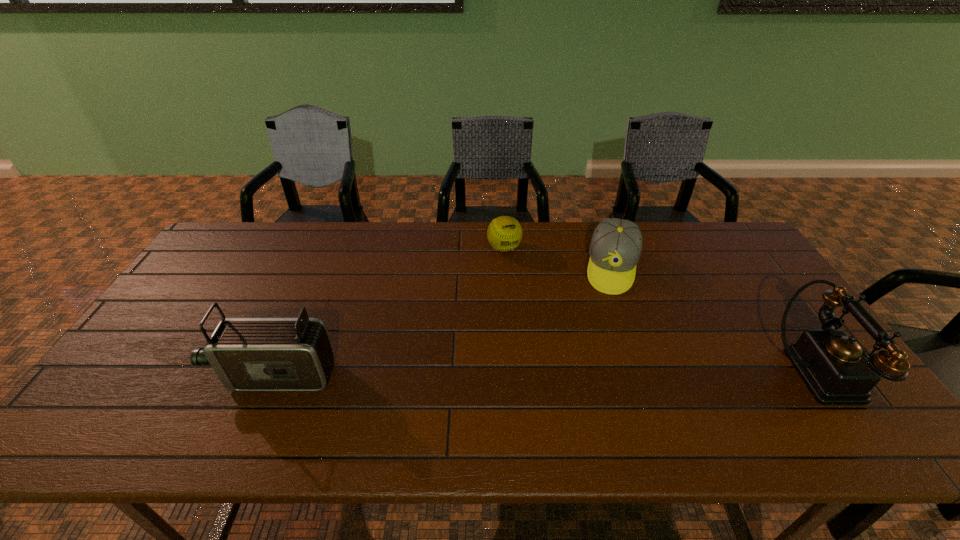
This screenshot has width=960, height=540. What are the coordinates of `free location located on the logo side of the third object from right to left` in the screenshot? It's located at (540, 309).

The height and width of the screenshot is (540, 960). Identify the location of vacant region located on the logo side of the third object from right to left. (526, 285).

Find the location of a particular element. vacant space located on the front-facing side of the baseball cap is located at coordinates (610, 313).

Locate an element on the screen. The image size is (960, 540). vacant area situated on the front-facing side of the baseball cap is located at coordinates (606, 343).

Find the location of a particular element. vacant space located on the front-facing side of the baseball cap is located at coordinates (603, 366).

Where is `softball that is at the far edge`? This screenshot has height=540, width=960. softball that is at the far edge is located at coordinates (504, 233).

Where is `baseball cap that is at the far edge`? baseball cap that is at the far edge is located at coordinates (616, 244).

What are the coordinates of `camcorder at the near edge` in the screenshot? It's located at (247, 354).

Where is `telephone at the near edge`? telephone at the near edge is located at coordinates (838, 370).

You are a GUI agent. You are given a task and a screenshot of the screen. Output one action in this format:
    pyautogui.click(x=<x>, y=<y>)
    Task: Click on the object that is at the right edge
    This screenshot has height=540, width=960.
    Given the screenshot: What is the action you would take?
    pyautogui.click(x=838, y=370)